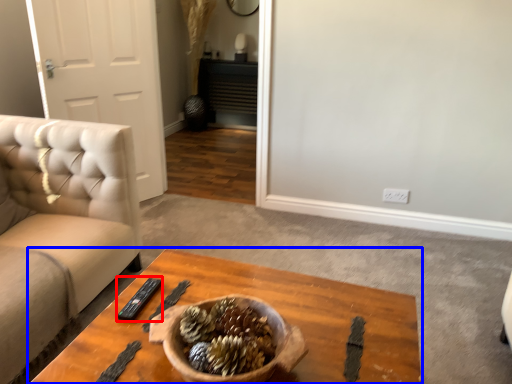
Question: Which of the following is the closest to the observer, remote (highlighted by a red box) or coffee table (highlighted by a blue box)?

Choices:
 (A) remote
 (B) coffee table

Answer: (B)